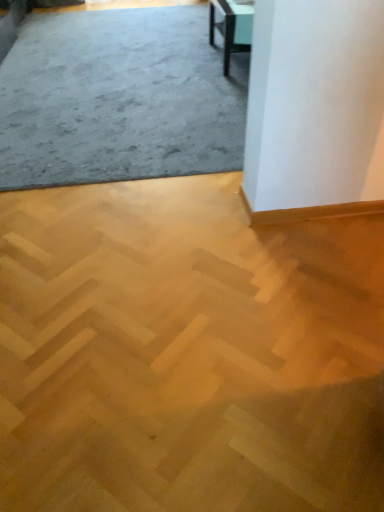
This screenshot has height=512, width=384. What are the coordinates of `gray carpet at upper left, acting as the 1th concrete starting from the back` in the screenshot? It's located at (119, 99).

From a real-world perspective, is matte black table at upper right physically below gray carpet at upper left, the second concrete when ordered from front to back?

No, from a real-world perspective, matte black table at upper right is not beneath gray carpet at upper left, the second concrete when ordered from front to back.

Could you tell me if matte black table at upper right is facing gray carpet at upper left, acting as the 1th concrete starting from the back?

Yes, matte black table at upper right is aimed at gray carpet at upper left, acting as the 1th concrete starting from the back.

Which is more to the right, matte black table at upper right or gray carpet at upper left, the second concrete when ordered from front to back?

matte black table at upper right is more to the right.

Considering the positions of point (250, 48) and point (200, 145), is point (250, 48) closer or farther from the camera than point (200, 145)?

Point (250, 48) appears to be farther away from the viewer than point (200, 145).

Considering the relative sizes of gray carpet at upper left, acting as the 1th concrete starting from the back, and light brown wood parquet at center, which is counted as the first concrete, starting from the front, in the image provided, is gray carpet at upper left, acting as the 1th concrete starting from the back, taller than light brown wood parquet at center, which is counted as the first concrete, starting from the front,?

Yes.

From a real-world perspective, which is physically below, gray carpet at upper left, acting as the 1th concrete starting from the back, or light brown wood parquet at center, the 1th concrete positioned from the bottom?

light brown wood parquet at center, the 1th concrete positioned from the bottom, from a real-world perspective.

Which is in front, point (88, 27) or point (290, 424)?

The point (290, 424) is closer.

Consider the image. From the image's perspective, which one is positioned lower, gray carpet at upper left, placed as the first concrete when sorted from top to bottom, or light brown wood parquet at center, the 2th concrete from the back?

light brown wood parquet at center, the 2th concrete from the back.

From the image's perspective, relative to matte black table at upper right, is light brown wood parquet at center, the 2th concrete from the back, above or below?

Clearly, from the image's perspective, light brown wood parquet at center, the 2th concrete from the back, is below matte black table at upper right.

Is light brown wood parquet at center, which is the 2th concrete from top to bottom, spatially inside matte black table at upper right, or outside of it?

light brown wood parquet at center, which is the 2th concrete from top to bottom, exists outside the volume of matte black table at upper right.

Is light brown wood parquet at center, the 2th concrete from the back, wider or thinner than matte black table at upper right?

Clearly, light brown wood parquet at center, the 2th concrete from the back, has more width compared to matte black table at upper right.

Consider the image. Which is closer, (377, 244) or (227, 70)?

Clearly, point (377, 244) is closer to the camera than point (227, 70).

Can you confirm if light brown wood parquet at center, the 1th concrete positioned from the bottom, is shorter than gray carpet at upper left, acting as the 1th concrete starting from the back?

Correct, light brown wood parquet at center, the 1th concrete positioned from the bottom, is not as tall as gray carpet at upper left, acting as the 1th concrete starting from the back.

From the image's perspective, is light brown wood parquet at center, the 2th concrete from the back, above or below gray carpet at upper left, the second concrete when ordered from front to back?

light brown wood parquet at center, the 2th concrete from the back, is below gray carpet at upper left, the second concrete when ordered from front to back.

Considering the positions of points (158, 250) and (60, 18), is point (158, 250) closer to camera compared to point (60, 18)?

Yes.

Which object is positioned more to the right, light brown wood parquet at center, which is counted as the first concrete, starting from the front, or gray carpet at upper left, acting as the 1th concrete starting from the back?

light brown wood parquet at center, which is counted as the first concrete, starting from the front, is more to the right.

Which object is further away from the camera taking this photo, matte black table at upper right or light brown wood parquet at center, which is counted as the first concrete, starting from the front?

matte black table at upper right is further away from the camera.

Is light brown wood parquet at center, which is counted as the first concrete, starting from the front, inside matte black table at upper right?

That's incorrect, light brown wood parquet at center, which is counted as the first concrete, starting from the front, is not inside matte black table at upper right.

Does matte black table at upper right have a smaller size compared to light brown wood parquet at center, the 1th concrete positioned from the bottom?

No, matte black table at upper right is not smaller than light brown wood parquet at center, the 1th concrete positioned from the bottom.

Is matte black table at upper right placed right next to light brown wood parquet at center, which is counted as the first concrete, starting from the front?

No, matte black table at upper right is not making contact with light brown wood parquet at center, which is counted as the first concrete, starting from the front.

Where is `concrete that is the 1st object located below the matte black table at upper right (from the image's perspective)`? concrete that is the 1st object located below the matte black table at upper right (from the image's perspective) is located at coordinates (119, 99).

From a real-world perspective, who is located lower, gray carpet at upper left, placed as the first concrete when sorted from top to bottom, or matte black table at upper right?

gray carpet at upper left, placed as the first concrete when sorted from top to bottom, is physically lower.

From the picture: Is the surface of gray carpet at upper left, the second concrete when ordered from front to back, in direct contact with matte black table at upper right?

gray carpet at upper left, the second concrete when ordered from front to back, is not next to matte black table at upper right, and they're not touching.

The image size is (384, 512). Identify the location of table on the right of gray carpet at upper left, acting as the 1th concrete starting from the back. (231, 28).

This screenshot has width=384, height=512. I want to click on concrete below the gray carpet at upper left, which appears as the 2th concrete when ordered from the bottom (from a real-world perspective), so click(x=187, y=353).

Estimate the real-world distances between objects in this image. Which object is closer to gray carpet at upper left, the second concrete when ordered from front to back, light brown wood parquet at center, the 1th concrete positioned from the bottom, or matte black table at upper right?

The object closer to gray carpet at upper left, the second concrete when ordered from front to back, is matte black table at upper right.

When comparing their distances from light brown wood parquet at center, the 1th concrete positioned from the bottom, does gray carpet at upper left, acting as the 1th concrete starting from the back, or matte black table at upper right seem closer?

gray carpet at upper left, acting as the 1th concrete starting from the back, is positioned closer to the anchor light brown wood parquet at center, the 1th concrete positioned from the bottom.

In the scene shown: From the image, which object appears to be farther from matte black table at upper right, gray carpet at upper left, placed as the first concrete when sorted from top to bottom, or light brown wood parquet at center, which is counted as the first concrete, starting from the front?

Based on the image, light brown wood parquet at center, which is counted as the first concrete, starting from the front, appears to be further to matte black table at upper right.

From the image, which object appears to be farther from gray carpet at upper left, which appears as the 2th concrete when ordered from the bottom, matte black table at upper right or light brown wood parquet at center, which is counted as the first concrete, starting from the front?

light brown wood parquet at center, which is counted as the first concrete, starting from the front, lies further to gray carpet at upper left, which appears as the 2th concrete when ordered from the bottom, than the other object.

Considering their positions, is light brown wood parquet at center, which is the 2th concrete from top to bottom, positioned further to matte black table at upper right than gray carpet at upper left, placed as the first concrete when sorted from top to bottom?

Based on the image, light brown wood parquet at center, which is the 2th concrete from top to bottom, appears to be further to matte black table at upper right.

Based on their spatial positions, is matte black table at upper right or gray carpet at upper left, acting as the 1th concrete starting from the back, closer to light brown wood parquet at center, the 1th concrete positioned from the bottom?

gray carpet at upper left, acting as the 1th concrete starting from the back, lies closer to light brown wood parquet at center, the 1th concrete positioned from the bottom, than the other object.

You are a GUI agent. You are given a task and a screenshot of the screen. Output one action in this format:
    pyautogui.click(x=<x>, y=<y>)
    Task: Click on the concrete between matte black table at upper right and light brown wood parquet at center, which is the 2th concrete from top to bottom, in the up-down direction
    The height and width of the screenshot is (512, 384).
    Given the screenshot: What is the action you would take?
    pyautogui.click(x=119, y=99)